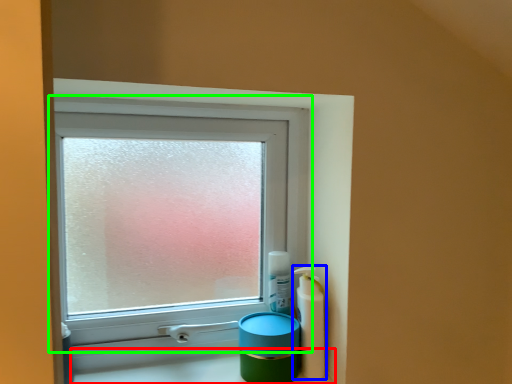
Question: Which is farther away from counter top (highlighted by a red box)? mouthwash (highlighted by a blue box) or window (highlighted by a green box)?

Choices:
 (A) mouthwash
 (B) window

Answer: (B)